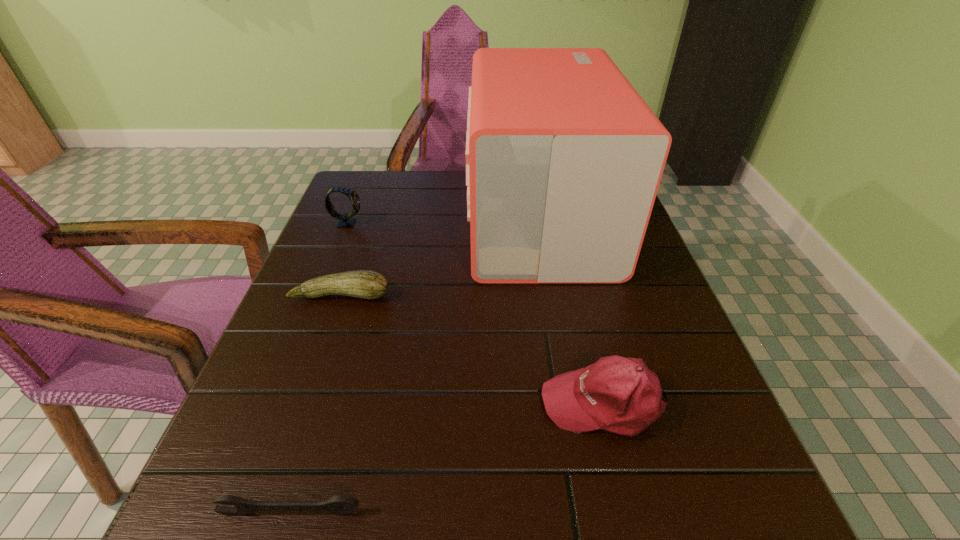
At what (x,y) coordinates should I click in order to perform the action: click on free space between the wrench and the watch. Please return your answer as a coordinate pair (x, y). The width and height of the screenshot is (960, 540). Looking at the image, I should click on (319, 368).

I want to click on blank region between the watch and the zucchini, so click(x=344, y=259).

At what (x,y) coordinates should I click in order to perform the action: click on vacant space that is in between the watch and the shortest object. Please return your answer as a coordinate pair (x, y). The width and height of the screenshot is (960, 540). Looking at the image, I should click on (319, 368).

Locate an element on the screen. This screenshot has height=540, width=960. free space between the zucchini and the wrench is located at coordinates pos(316,404).

Locate an element on the screen. vacant area between the wrench and the zucchini is located at coordinates (316, 404).

In order to click on vacant space that's between the second nearest object and the wrench in this screenshot , I will do `click(447, 458)`.

This screenshot has width=960, height=540. Find the location of `blank region between the wrench and the second nearest object`. blank region between the wrench and the second nearest object is located at coordinates (447, 458).

Locate an element on the screen. vacant area that lies between the tallest object and the watch is located at coordinates (444, 221).

Where is `unoccupied position between the fourth farthest object and the second shortest object`? This screenshot has width=960, height=540. unoccupied position between the fourth farthest object and the second shortest object is located at coordinates (472, 349).

Locate which object ranks second in proximity to the watch. Please provide its 2D coordinates. Your answer should be formatted as a tuple, i.e. [(x, y)], where the tuple contains the x and y coordinates of a point satisfying the conditions above.

[(564, 158)]